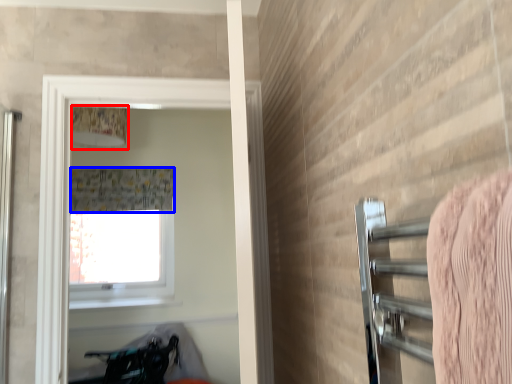
Question: Which point is further to the camera, lamp (highlighted by a red box) or shower curtain (highlighted by a blue box)?

Choices:
 (A) lamp
 (B) shower curtain

Answer: (A)